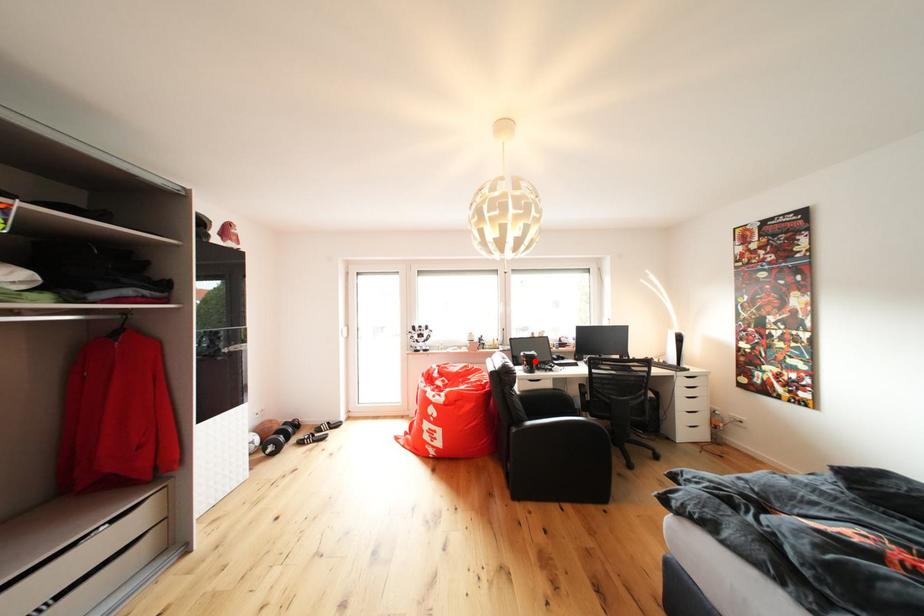
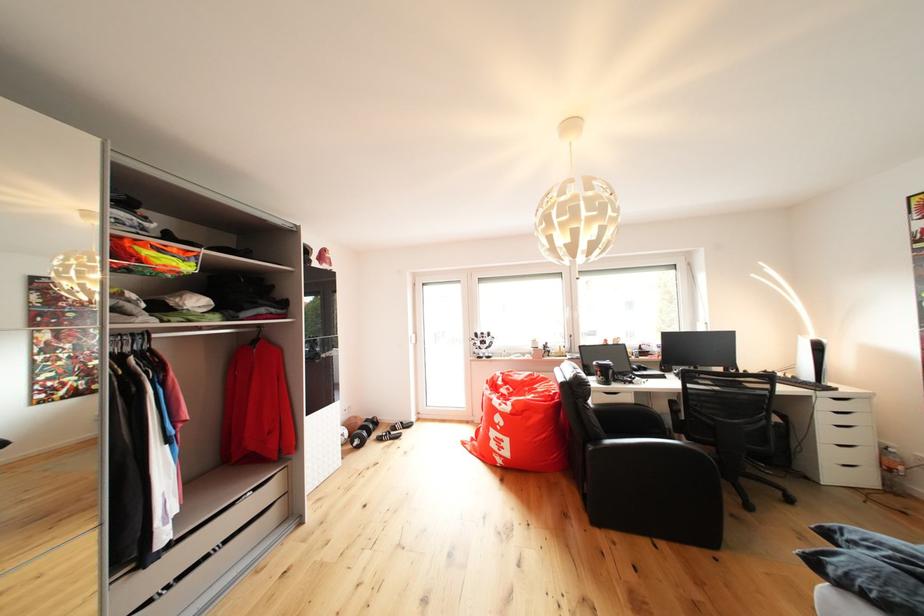
The point at the highlighted location is marked in the first image. Where is the corresponding point in the second image?

(609, 371)